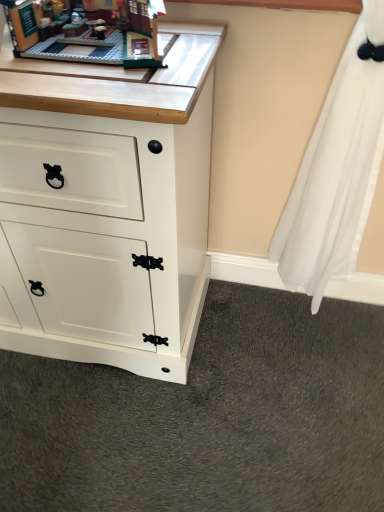
The height and width of the screenshot is (512, 384). I want to click on vacant area located to the right-hand side of brick-like lego set at upper left, so click(x=193, y=46).